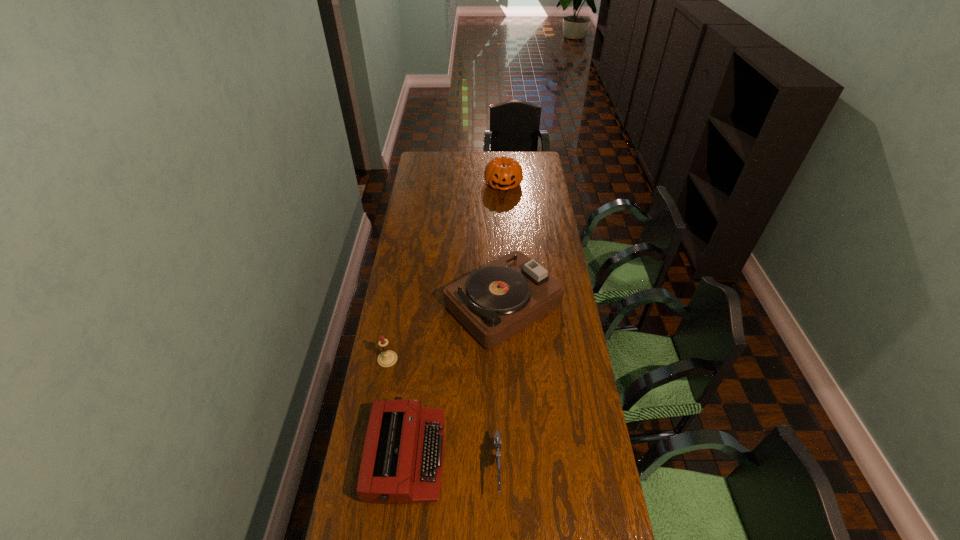
Identify the location of pumpkin. The image size is (960, 540). (503, 173).

Identify the location of record player. (495, 302).

The width and height of the screenshot is (960, 540). In order to click on the third nearest object in this screenshot , I will do `click(387, 358)`.

Where is `gun`? gun is located at coordinates (497, 438).

Image resolution: width=960 pixels, height=540 pixels. Identify the location of typewriter. (402, 460).

Identify the location of blank area located on the carved face of the pumpkin. (505, 217).

At what (x,y) coordinates should I click in order to perform the action: click on vacant space located 0.090m on the left of the record player. Please return your answer as a coordinate pair (x, y). This screenshot has height=540, width=960. Looking at the image, I should click on (422, 305).

Locate an element on the screen. This screenshot has height=540, width=960. vacant position located on the back of the candle is located at coordinates (392, 334).

The height and width of the screenshot is (540, 960). I want to click on vacant space situated on the typing side of the typewriter, so click(510, 456).

Locate an element on the screen. This screenshot has width=960, height=540. object at the far edge is located at coordinates (503, 173).